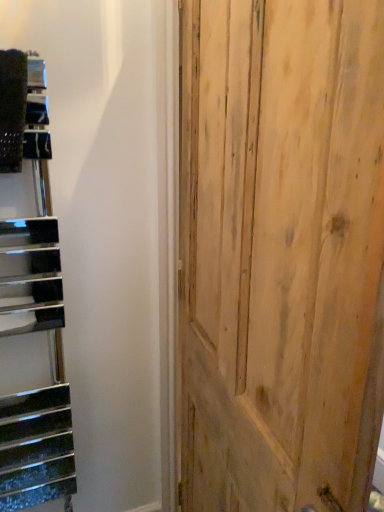
Question: From a real-world perspective, is natural wood door at center beneath metallic black stairwell at left?

Choices:
 (A) yes
 (B) no

Answer: (A)

Question: Is natural wood door at center far from metallic black stairwell at left?

Choices:
 (A) yes
 (B) no

Answer: (B)

Question: Is natural wood door at center taller than metallic black stairwell at left?

Choices:
 (A) yes
 (B) no

Answer: (A)

Question: From a real-world perspective, does natural wood door at center stand above metallic black stairwell at left?

Choices:
 (A) no
 (B) yes

Answer: (A)

Question: Can you confirm if natural wood door at center is bigger than metallic black stairwell at left?

Choices:
 (A) no
 (B) yes

Answer: (B)

Question: Does natural wood door at center turn towards metallic black stairwell at left?

Choices:
 (A) no
 (B) yes

Answer: (A)

Question: Is metallic black stairwell at left bigger than natural wood door at center?

Choices:
 (A) no
 (B) yes

Answer: (A)

Question: Is the position of metallic black stairwell at left more distant than that of natural wood door at center?

Choices:
 (A) yes
 (B) no

Answer: (A)

Question: Is metallic black stairwell at left to the left of natural wood door at center from the viewer's perspective?

Choices:
 (A) no
 (B) yes

Answer: (B)

Question: From the image's perspective, is metallic black stairwell at left below natural wood door at center?

Choices:
 (A) no
 (B) yes

Answer: (A)

Question: Does metallic black stairwell at left have a smaller size compared to natural wood door at center?

Choices:
 (A) no
 (B) yes

Answer: (B)

Question: Are metallic black stairwell at left and natural wood door at center located far from each other?

Choices:
 (A) yes
 (B) no

Answer: (B)

Question: Looking at the image, does natural wood door at center seem bigger or smaller compared to metallic black stairwell at left?

Choices:
 (A) big
 (B) small

Answer: (A)